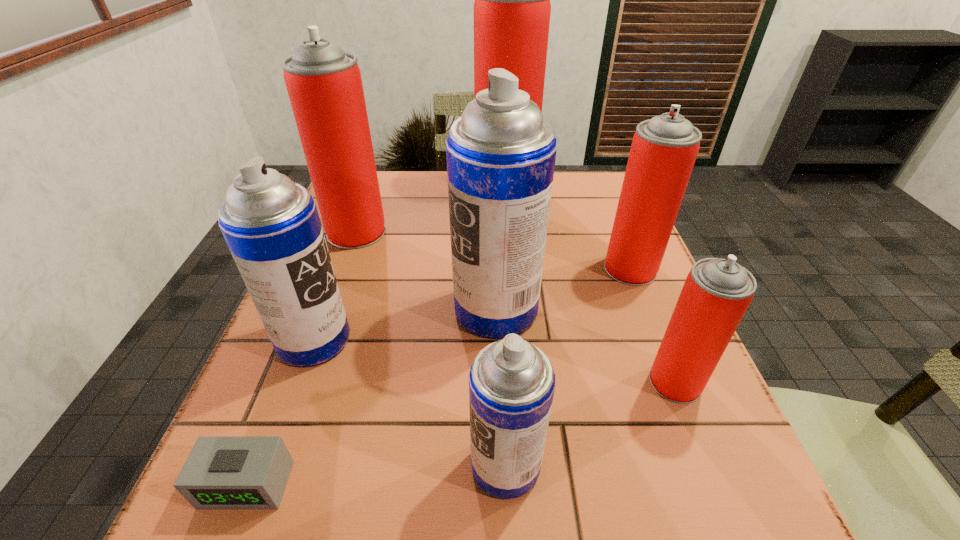
Where is `the tallest aerosol can`? Image resolution: width=960 pixels, height=540 pixels. the tallest aerosol can is located at coordinates (512, 8).

This screenshot has height=540, width=960. I want to click on the tallest object, so 512,8.

Where is `the biggest blue aerosol can`? The image size is (960, 540). the biggest blue aerosol can is located at coordinates (501, 153).

Locate an element on the screen. the leftmost red aerosol can is located at coordinates (324, 84).

Find the location of a particular element. This screenshot has width=960, height=540. the second farthest aerosol can is located at coordinates (324, 84).

Identify the location of the second smallest red aerosol can. (664, 149).

The height and width of the screenshot is (540, 960). Identify the location of the second smallest blue aerosol can. coord(271,225).

Identify the location of the nearest red aerosol can. The height and width of the screenshot is (540, 960). (717, 292).

Where is `the nearest blue aerosol can`? the nearest blue aerosol can is located at coordinates (511, 382).

This screenshot has width=960, height=540. I want to click on the smallest blue aerosol can, so click(x=511, y=382).